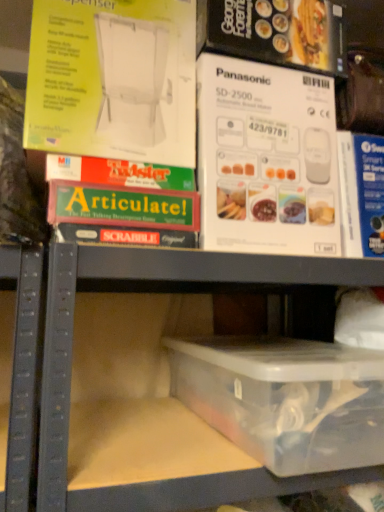
Question: Are transparent plastic container at lower center and transparent plastic container at lower center far apart?

Choices:
 (A) no
 (B) yes

Answer: (A)

Question: Is transparent plastic container at lower center with transparent plastic container at lower center?

Choices:
 (A) yes
 (B) no

Answer: (B)

Question: Does transparent plastic container at lower center lie in front of transparent plastic container at lower center?

Choices:
 (A) no
 (B) yes

Answer: (A)

Question: Considering the relative sizes of transparent plastic container at lower center and transparent plastic container at lower center in the image provided, is transparent plastic container at lower center shorter than transparent plastic container at lower center?

Choices:
 (A) no
 (B) yes

Answer: (B)

Question: Can you confirm if transparent plastic container at lower center is bigger than transparent plastic container at lower center?

Choices:
 (A) yes
 (B) no

Answer: (B)

Question: Is transparent plastic container at lower center spatially inside transparent plastic container at lower center, or outside of it?

Choices:
 (A) inside
 (B) outside

Answer: (A)

Question: In terms of size, does transparent plastic container at lower center appear bigger or smaller than transparent plastic container at lower center?

Choices:
 (A) small
 (B) big

Answer: (A)

Question: Considering their positions, is transparent plastic container at lower center located in front of or behind transparent plastic container at lower center?

Choices:
 (A) front
 (B) behind

Answer: (B)

Question: Considering the positions of transparent plastic container at lower center and transparent plastic container at lower center in the image, is transparent plastic container at lower center wider or thinner than transparent plastic container at lower center?

Choices:
 (A) thin
 (B) wide

Answer: (B)

Question: Is transparent plastic container at lower center wider or thinner than green matte board game at upper left?

Choices:
 (A) thin
 (B) wide

Answer: (B)

Question: In the image, is transparent plastic container at lower center positioned in front of or behind green matte board game at upper left?

Choices:
 (A) front
 (B) behind

Answer: (A)

Question: From the image's perspective, is transparent plastic container at lower center located above or below green matte board game at upper left?

Choices:
 (A) below
 (B) above

Answer: (A)

Question: Visually, is transparent plastic container at lower center positioned to the left or to the right of green matte board game at upper left?

Choices:
 (A) right
 (B) left

Answer: (A)

Question: Is green matte board game at upper left wider or thinner than transparent plastic container at lower center?

Choices:
 (A) thin
 (B) wide

Answer: (A)

Question: In the image, is green matte board game at upper left on the left side or the right side of transparent plastic container at lower center?

Choices:
 (A) left
 (B) right

Answer: (A)